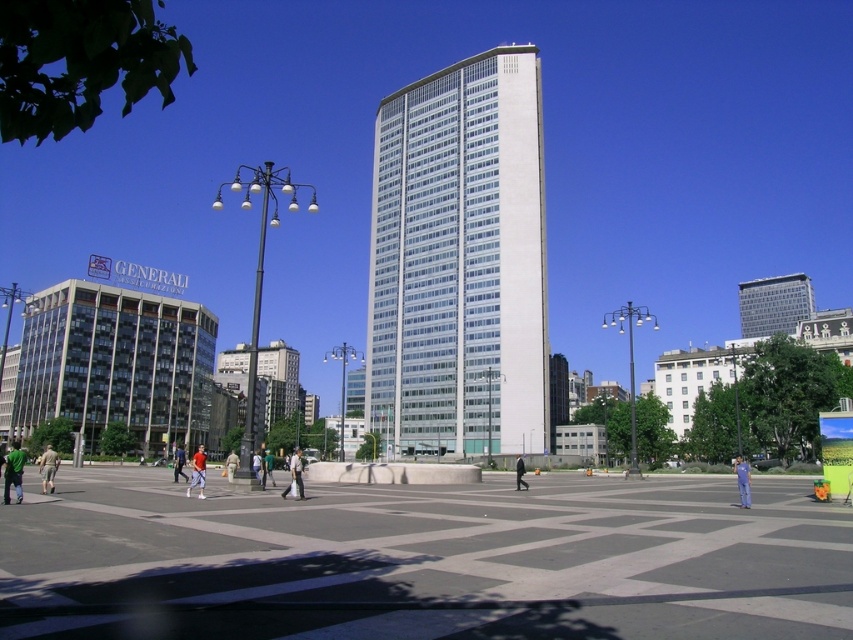
Question: Estimate the real-world distances between objects in this image. Which object is closer to the green fabric pants at center?

Choices:
 (A) white concrete plaza at center
 (B) khaki fabric pants at center

Answer: (B)

Question: Which of the following is the closest to the observer?

Choices:
 (A) (271, 481)
 (B) (740, 484)
 (C) (296, 474)

Answer: (B)

Question: From the image, what is the correct spatial relationship of orange cotton shirt at center in relation to khaki fabric pants at center?

Choices:
 (A) above
 (B) below

Answer: (A)

Question: Among these objects, which one is nearest to the camera?

Choices:
 (A) clear glass skyscraper at upper right
 (B) khaki fabric pants at center
 (C) white glass building at center
 (D) orange cotton shirt at center

Answer: (D)

Question: Does green fabric shirt at lower left have a lesser width compared to khaki pants at lower left?

Choices:
 (A) yes
 (B) no

Answer: (B)

Question: Is khaki pants at lower left in front of light brown leather jacket at center?

Choices:
 (A) yes
 (B) no

Answer: (A)